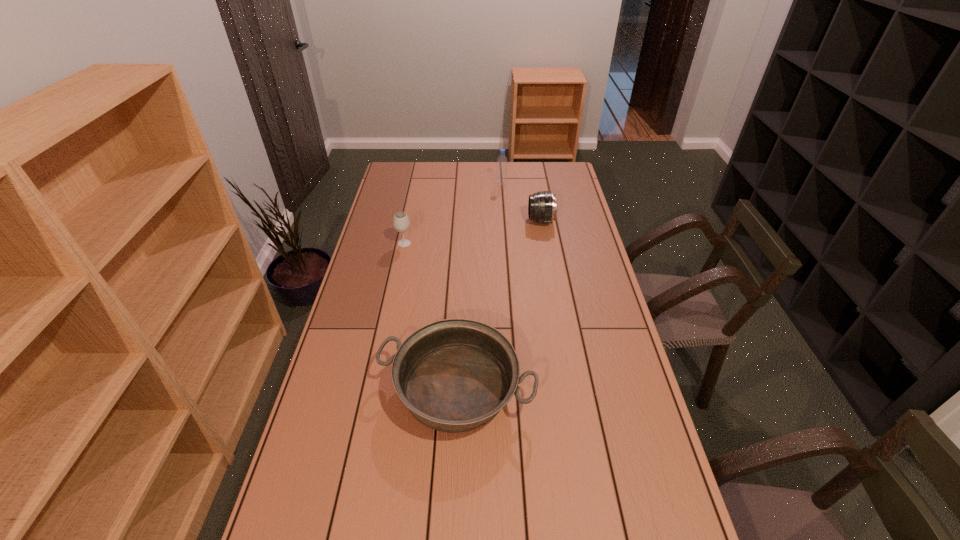
You are a GUI agent. You are given a task and a screenshot of the screen. Output one action in this format:
    pyautogui.click(x=<x>, y=<y>)
    Task: Click on the vacant region located 0.280m at the front element of the rightmost object
    The height and width of the screenshot is (540, 960).
    Given the screenshot: What is the action you would take?
    pyautogui.click(x=464, y=221)

This screenshot has width=960, height=540. What are the coordinates of `free space located at the front element of the rightmost object` in the screenshot? It's located at (441, 221).

Image resolution: width=960 pixels, height=540 pixels. Identify the location of vacant space located 0.280m on the right of the shortest object. (631, 389).

Locate an element on the screen. This screenshot has width=960, height=540. object positioned at the far edge is located at coordinates (502, 162).

Locate an element on the screen. The image size is (960, 540). object positioned at the left edge is located at coordinates (401, 223).

Identify the location of object at the right edge. (542, 208).

At what (x,y) coordinates should I click in order to perform the action: click on vacant space at the left edge. Please return your answer as a coordinate pair (x, y). Looking at the image, I should click on (339, 513).

The image size is (960, 540). What are the coordinates of `free spot at the right edge of the desktop` in the screenshot? It's located at (625, 447).

The image size is (960, 540). Identify the location of free space at the far left corner of the desktop. (389, 171).

Identify the location of vacant space at the far right corner of the desktop. (555, 163).